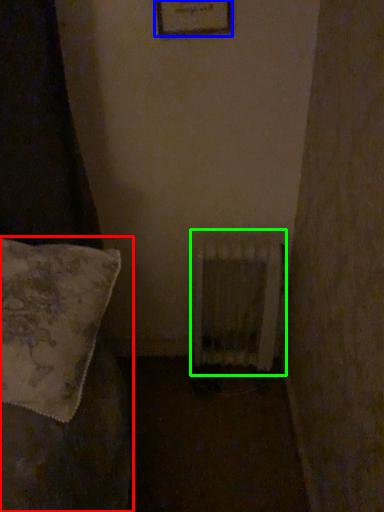
Question: Considering the real-world distances, which object is farthest from furniture (highlighted by a red box)? picture frame (highlighted by a blue box) or radiator (highlighted by a green box)?

Choices:
 (A) picture frame
 (B) radiator

Answer: (A)